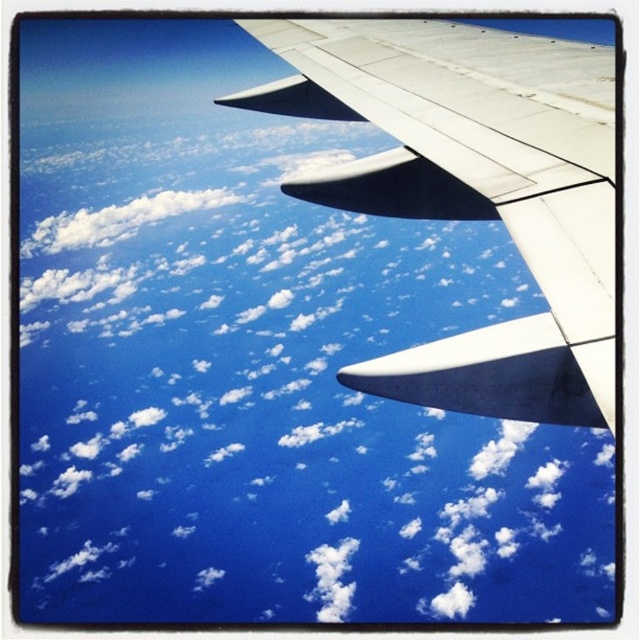
Question: Can you confirm if white fluffy cloud at upper center is positioned below white matte wing at upper right?

Choices:
 (A) no
 (B) yes

Answer: (A)

Question: Which object appears closest to the camera in this image?

Choices:
 (A) white matte wing at upper right
 (B) white fluffy cloud at upper center

Answer: (A)

Question: Does white fluffy cloud at upper center have a larger size compared to white matte wing at upper right?

Choices:
 (A) yes
 (B) no

Answer: (A)

Question: Can you confirm if white fluffy cloud at upper center is positioned below white matte wing at upper right?

Choices:
 (A) yes
 (B) no

Answer: (B)